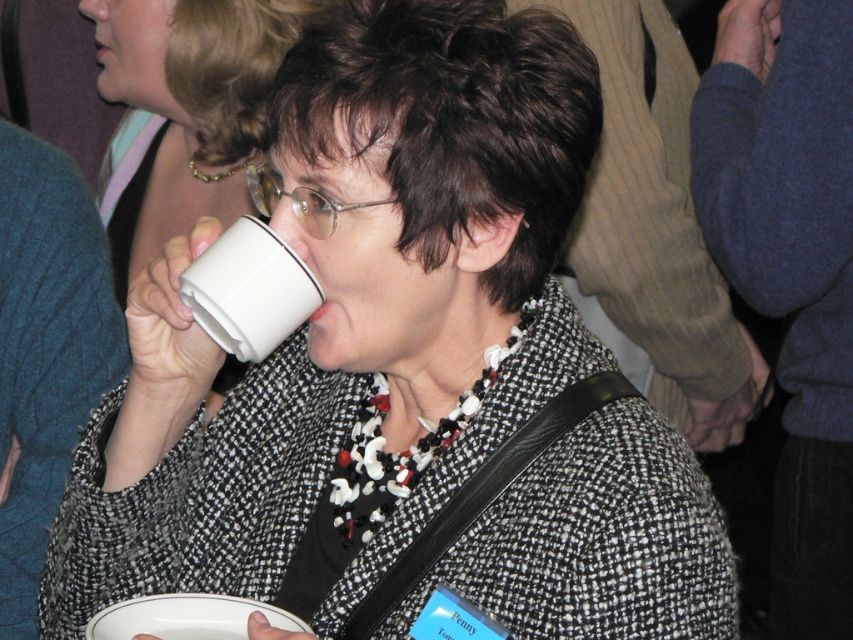
Question: Which object is closer to the camera taking this photo?

Choices:
 (A) white matte cup at upper center
 (B) white ceramic mug at upper center

Answer: (B)

Question: Is white matte cup at upper center to the left of white ceramic mug at upper center from the viewer's perspective?

Choices:
 (A) yes
 (B) no

Answer: (A)

Question: From the image, what is the correct spatial relationship of white matte cup at upper center in relation to white ceramic mug at upper center?

Choices:
 (A) left
 (B) right

Answer: (A)

Question: From the image, what is the correct spatial relationship of white matte cup at upper center in relation to white ceramic mug at upper center?

Choices:
 (A) left
 (B) right

Answer: (A)